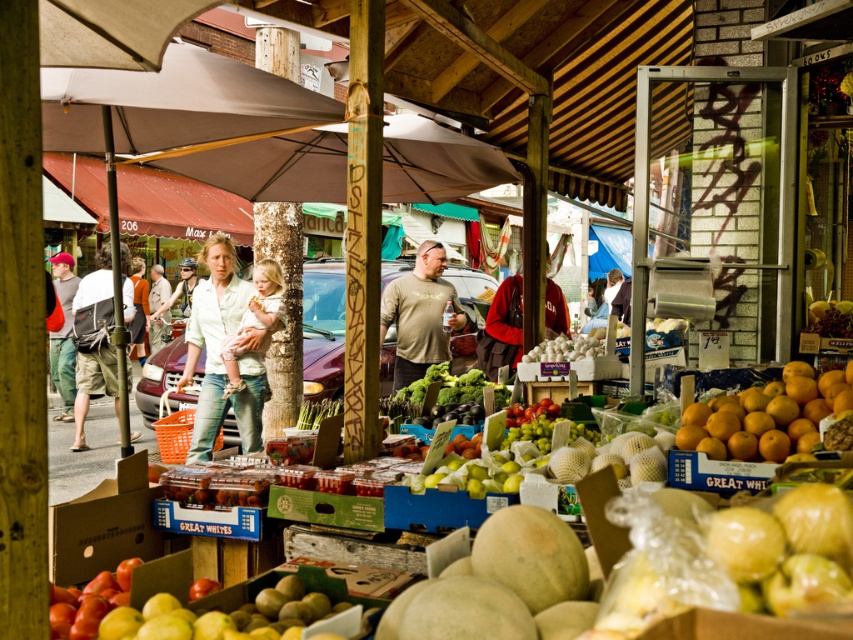
Question: Can you confirm if orange matte/orange at right is smaller than matte khaki shirt at center?

Choices:
 (A) yes
 (B) no

Answer: (A)

Question: Is matte khaki shirt at center positioned before matte red shirt at left?

Choices:
 (A) yes
 (B) no

Answer: (A)

Question: Can you confirm if orange matte/orange at right is bigger than light beige denim jeans at center?

Choices:
 (A) no
 (B) yes

Answer: (A)

Question: Which of the following is the farthest from the observer?

Choices:
 (A) light beige denim jeans at center
 (B) matte red shirt at left
 (C) brown fabric umbrella at upper center
 (D) orange matte/orange at right

Answer: (B)

Question: Estimate the real-world distances between objects in this image. Which object is closer to the matte khaki shirt at center?

Choices:
 (A) green leafy vegetables at center
 (B) matte red shirt at left
 (C) brown fabric umbrella at upper center

Answer: (A)

Question: Which object is positioned closest to the green leafy vegetables at center?

Choices:
 (A) matte red shirt at left
 (B) matte khaki shirt at center

Answer: (B)